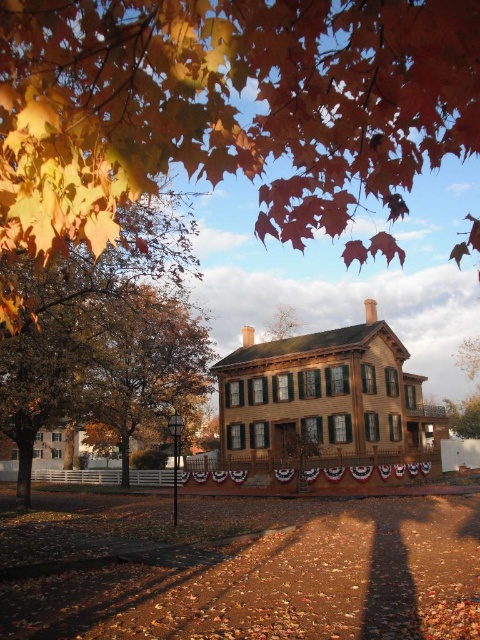
You are standing in front of the brown wooden house at center and want to take a photo of the golden leafy tree at upper left. Since the tree is partially hidden by the house, will you need to move closer to the tree or further away from it to get a clear view?

The golden leafy tree at upper left is closer to the viewer than brown wooden house at center. To get a clear view of the tree, you should move closer to the tree to avoid the house blocking it.

You are standing in front of the two story wooden house with dark green shutters. You want to take a photo of the golden leafy tree at upper left using a camera that has a maximum focus range of 6 meters. Will the camera be able to focus on the tree?

The golden leafy tree at upper left and camera are 6.38 meters apart, which exceeds the camera maximum focus range of 6 meters. Therefore, the camera will not be able to focus on the tree.